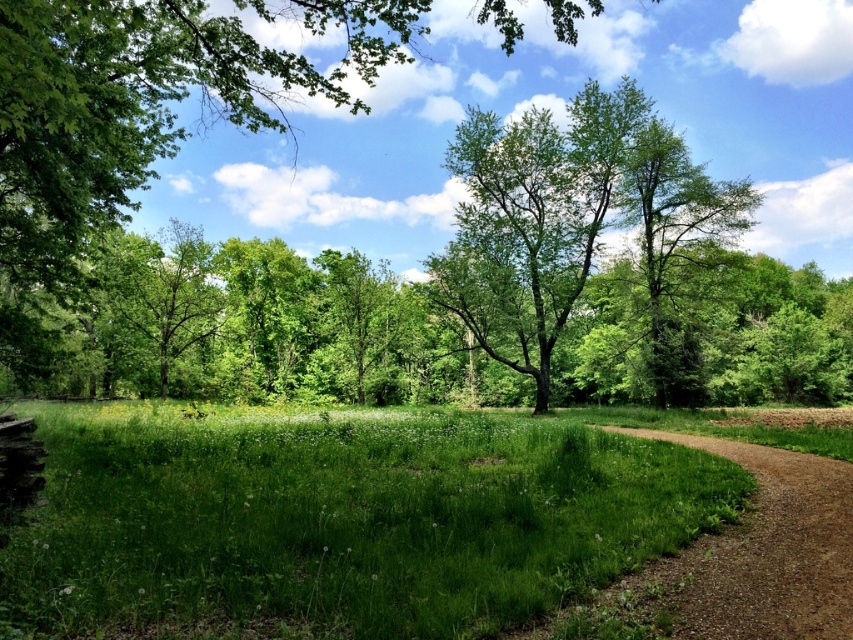
Question: Which point appears closest to the camera in this image?

Choices:
 (A) (x=24, y=168)
 (B) (x=26, y=486)

Answer: (B)

Question: Which object is positioned closest to the green leafy tree at upper center?

Choices:
 (A) green grassy field at lower left
 (B) green leafy tree at left

Answer: (B)

Question: Is green grassy field at lower left wider than green leafy tree at left?

Choices:
 (A) no
 (B) yes

Answer: (B)

Question: Which of these objects is positioned farthest from the rustic wooden bench at lower left?

Choices:
 (A) green leafy tree at left
 (B) green leafy tree at upper center
 (C) green grassy field at lower left

Answer: (A)

Question: Does green leafy tree at upper center have a greater width compared to rustic wooden bench at lower left?

Choices:
 (A) yes
 (B) no

Answer: (A)

Question: Is green leafy tree at upper center smaller than rustic wooden bench at lower left?

Choices:
 (A) no
 (B) yes

Answer: (A)